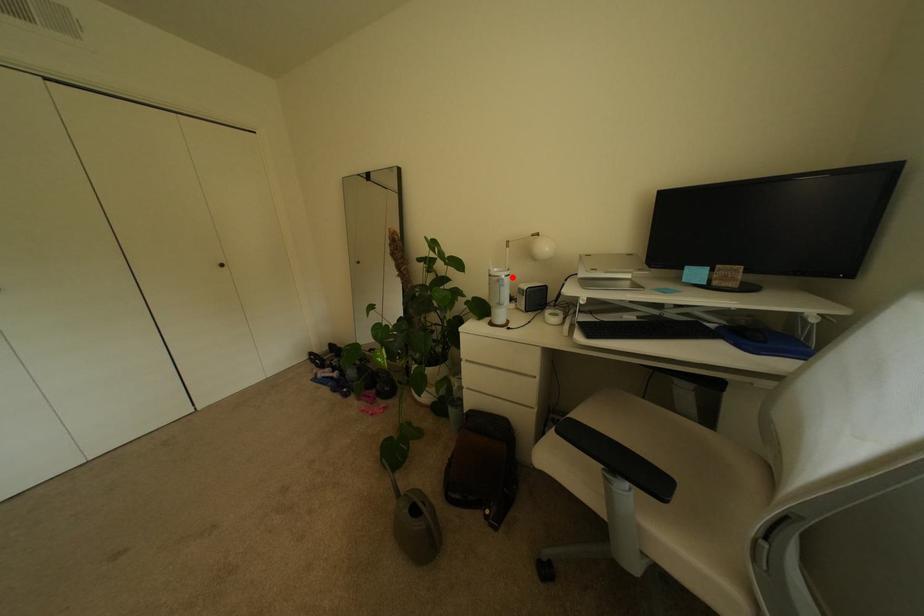
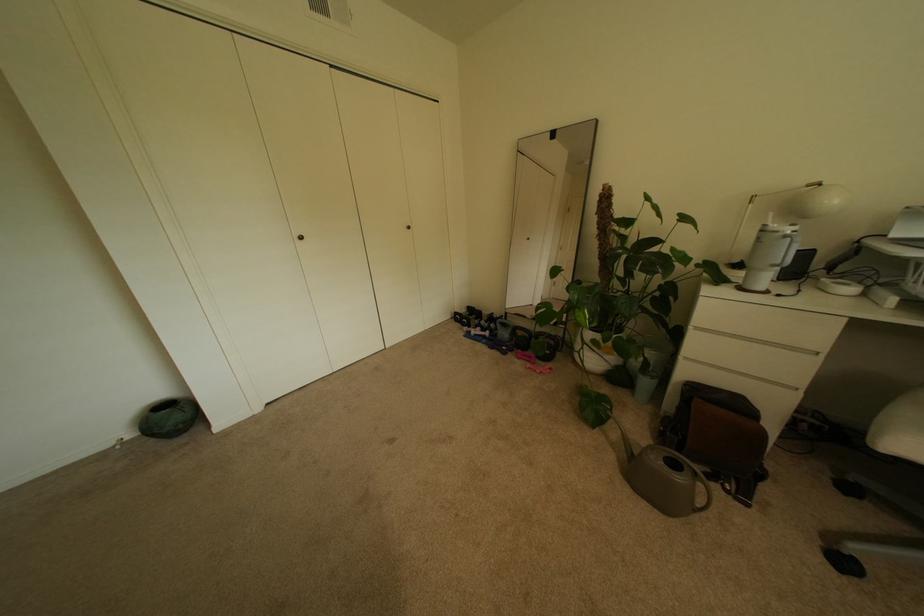
Question: I am providing you with two images of the same scene from different viewpoints. A red point is marked on the first image. At the location where the point appears in image 1, is it still visible in image 2?

Choices:
 (A) Yes
 (B) No

Answer: (A)